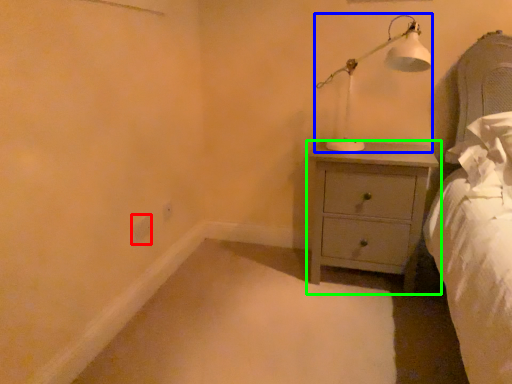
Question: Which is nearer to the electric outlet (highlighted by a red box)? table lamp (highlighted by a blue box) or chest of drawers (highlighted by a green box).

Choices:
 (A) table lamp
 (B) chest of drawers

Answer: (B)